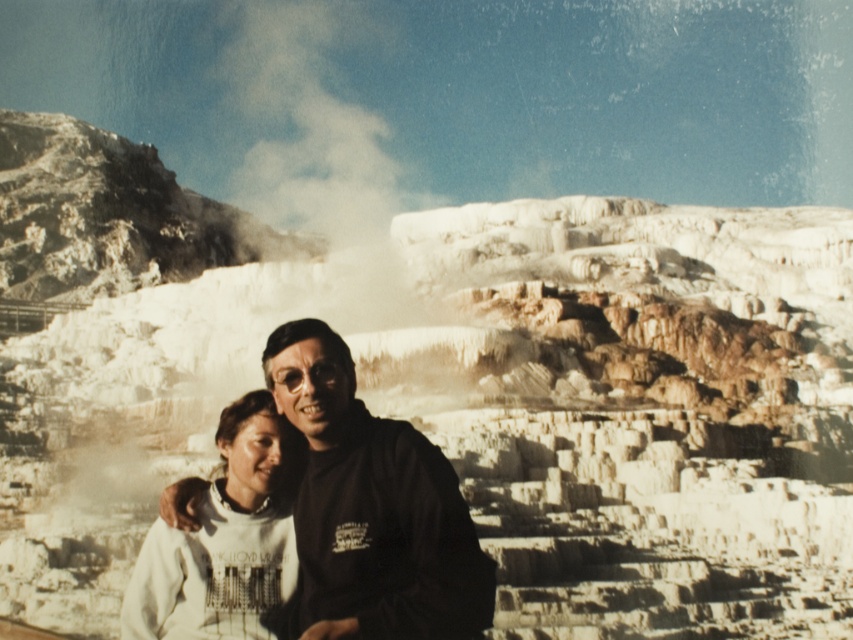
Question: Can you confirm if white matte sweatshirt at center is positioned to the left of white fleece sweatshirt at center?

Choices:
 (A) yes
 (B) no

Answer: (B)

Question: Is white matte sweatshirt at center wider than white fleece sweatshirt at center?

Choices:
 (A) no
 (B) yes

Answer: (B)

Question: Which object appears closest to the camera in this image?

Choices:
 (A) white fleece sweatshirt at center
 (B) white matte sweatshirt at center

Answer: (B)

Question: Which object is closer to the camera taking this photo?

Choices:
 (A) white fleece sweatshirt at center
 (B) white matte sweatshirt at center

Answer: (B)

Question: Where is white matte sweatshirt at center located in relation to white fleece sweatshirt at center in the image?

Choices:
 (A) above
 (B) below

Answer: (A)

Question: Which point appears farthest from the camera in this image?

Choices:
 (A) (294, 573)
 (B) (322, 428)

Answer: (A)